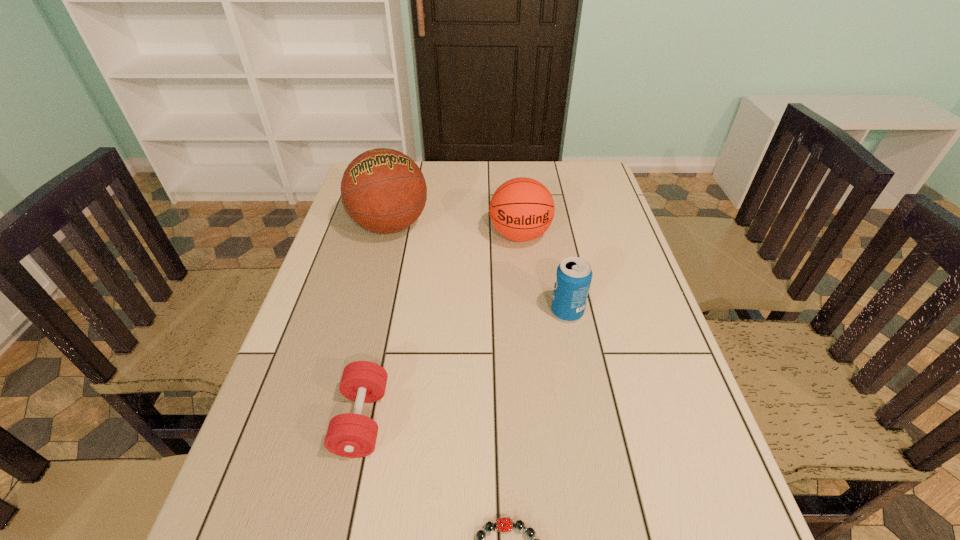
Identify the location of free space located on the front of the third tallest object. (575, 350).

Find the location of a particular element. The image size is (960, 540). vacant space located 0.120m on the left of the fourth farthest object is located at coordinates (280, 420).

Locate an element on the screen. The image size is (960, 540). basketball located at the left edge is located at coordinates (384, 191).

Identify the location of dumbbell positioned at the left edge. The height and width of the screenshot is (540, 960). (352, 435).

In order to click on vacant space at the near edge of the desktop in this screenshot , I will do `click(418, 539)`.

Where is `free space at the left edge`? The image size is (960, 540). free space at the left edge is located at coordinates (265, 496).

In the image, there is a desktop. Where is `vacant space at the right edge`? vacant space at the right edge is located at coordinates point(578,199).

Image resolution: width=960 pixels, height=540 pixels. Identify the location of free spot between the fourth shortest object and the taller basketball. (455, 231).

The height and width of the screenshot is (540, 960). What are the coordinates of `free space between the third nearest object and the tallest object` in the screenshot? It's located at tap(479, 269).

Where is `vacant area that lies between the right basketball and the tallest object`? The width and height of the screenshot is (960, 540). vacant area that lies between the right basketball and the tallest object is located at coordinates (455, 231).